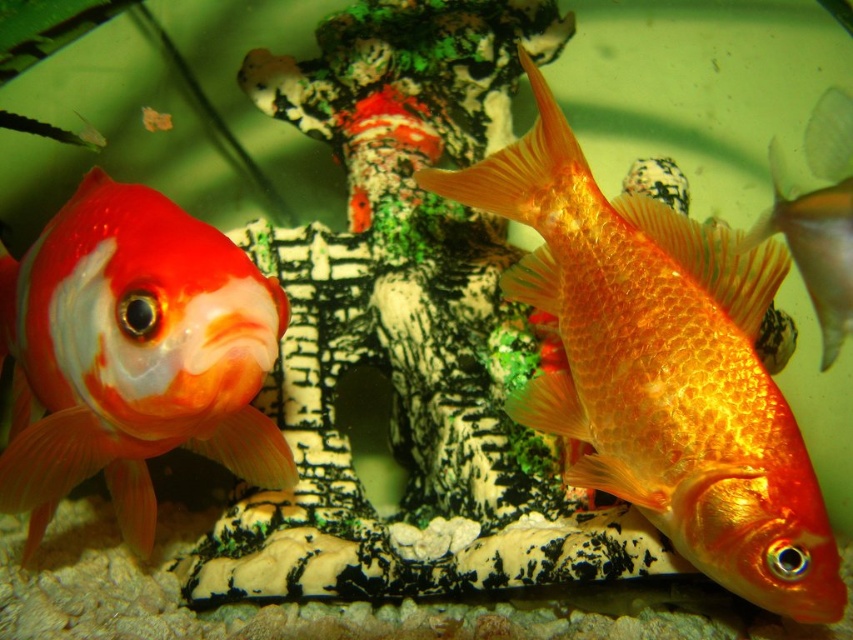
Question: Does shiny orange fish at center appear on the left side of shiny orange fish at right?

Choices:
 (A) no
 (B) yes

Answer: (B)

Question: Based on their relative distances, which object is farther from the shiny orange goldfish at left?

Choices:
 (A) shiny orange fish at center
 (B) shiny orange fish at right

Answer: (B)

Question: Does shiny orange fish at center have a lesser width compared to shiny orange fish at right?

Choices:
 (A) yes
 (B) no

Answer: (B)

Question: Which of the following is the farthest from the observer?

Choices:
 (A) shiny orange fish at center
 (B) shiny orange fish at right
 (C) shiny orange goldfish at left

Answer: (B)

Question: Observing the image, what is the correct spatial positioning of shiny orange fish at center in reference to shiny orange fish at right?

Choices:
 (A) above
 (B) below

Answer: (B)

Question: Which is farther from the shiny orange goldfish at left?

Choices:
 (A) shiny orange fish at center
 (B) shiny orange fish at right

Answer: (B)